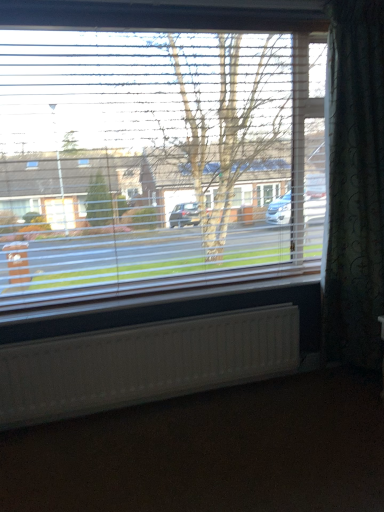
Question: Relative to white textured radiator at lower center, is brown matte carpet at lower center in front or behind?

Choices:
 (A) front
 (B) behind

Answer: (A)

Question: Do you think brown matte carpet at lower center is within white textured radiator at lower center, or outside of it?

Choices:
 (A) inside
 (B) outside

Answer: (B)

Question: Based on their relative distances, which object is farther from the white textured radiator at lower center?

Choices:
 (A) transparent plastic blinds at upper center
 (B) brown matte carpet at lower center
 (C) dark green textured curtain at right

Answer: (C)

Question: Based on their relative distances, which object is farther from the white textured radiator at lower center?

Choices:
 (A) brown matte carpet at lower center
 (B) dark green textured curtain at right
 (C) transparent plastic blinds at upper center

Answer: (B)